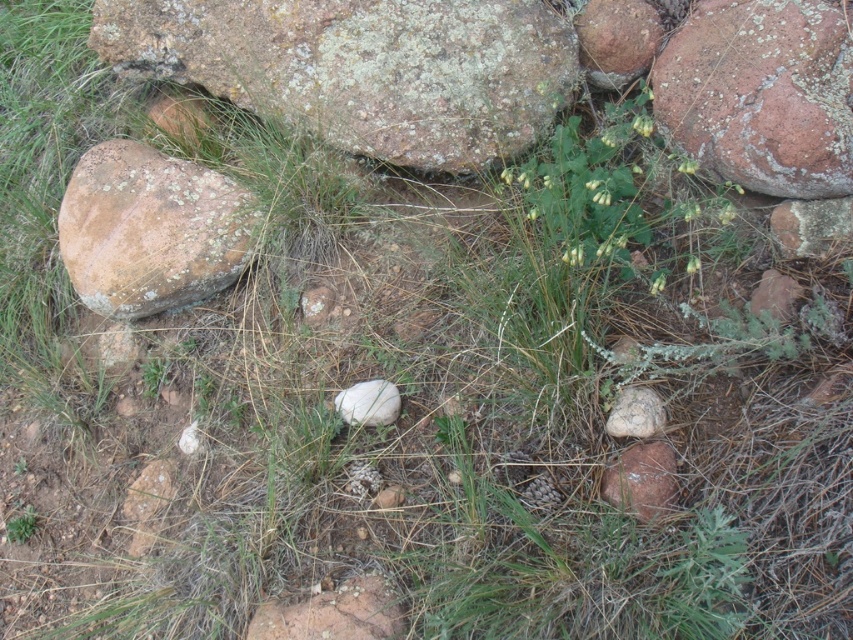
Which is in front, point (780, 64) or point (129, 179)?

Point (780, 64) is more forward.

Between rusty stone at upper right and lichen-covered rock at left, which one appears on the right side from the viewer's perspective?

rusty stone at upper right

At what (x,y) coordinates should I click in order to perform the action: click on rusty stone at upper right. Please return your answer as a coordinate pair (x, y). Looking at the image, I should click on (761, 93).

Does lichen-covered rock at upper center lie in front of brown rough rock at center?

No, it is not.

Can you confirm if lichen-covered rock at upper center is taller than brown rough rock at center?

Yes, lichen-covered rock at upper center is taller than brown rough rock at center.

Who is more distant from viewer, (495, 76) or (392, 627)?

The point (495, 76) is more distant.

Identify the location of lichen-covered rock at upper center. The image size is (853, 640). (363, 67).

Who is more distant from viewer, (x=352, y=99) or (x=370, y=396)?

The point (x=352, y=99) is more distant.

Between lichen-covered rock at upper center and white smooth rock at center, which one is positioned higher?

lichen-covered rock at upper center

Does point (352, 81) lie behind point (369, 388)?

That is True.

Image resolution: width=853 pixels, height=640 pixels. Identify the location of lichen-covered rock at upper center. (363, 67).